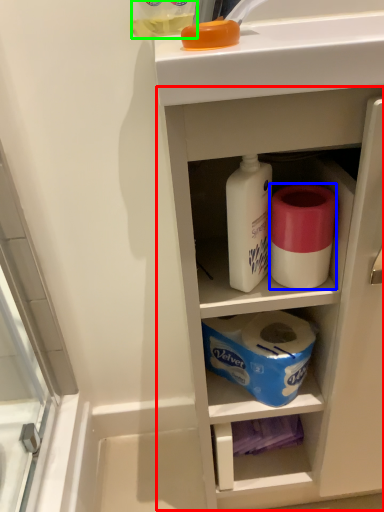
Question: Based on their relative distances, which object is farther from cabinetry (highlighted by a red box)? Choose from toilet paper (highlighted by a blue box) and bottle (highlighted by a green box).

Choices:
 (A) toilet paper
 (B) bottle

Answer: (B)